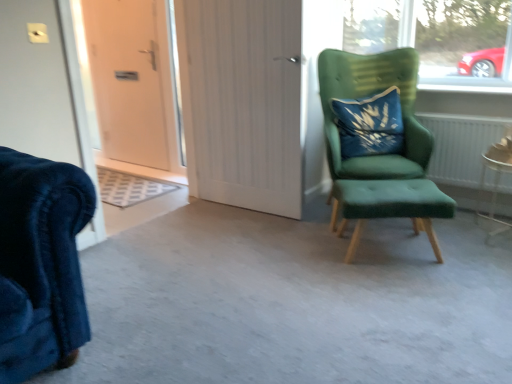
Question: Which direction should I rotate to face white wood door at center, acting as the 1th door starting from the front, — up or down?

Choices:
 (A) up
 (B) down

Answer: (A)

Question: Is green fabric stool at right inside green fabric chair at right?

Choices:
 (A) yes
 (B) no

Answer: (B)

Question: Is green fabric stool at right at the back of green fabric chair at right?

Choices:
 (A) no
 (B) yes

Answer: (A)

Question: Is green fabric chair at right not close to green fabric stool at right?

Choices:
 (A) yes
 (B) no

Answer: (B)

Question: Is green fabric chair at right at the right side of green fabric stool at right?

Choices:
 (A) yes
 (B) no

Answer: (A)

Question: Is green fabric chair at right outside of green fabric stool at right?

Choices:
 (A) yes
 (B) no

Answer: (A)

Question: Is green fabric chair at right thinner than green fabric stool at right?

Choices:
 (A) no
 (B) yes

Answer: (A)

Question: Is transparent glass door at upper left far from metallic silver side table at lower right?

Choices:
 (A) yes
 (B) no

Answer: (A)

Question: From a real-world perspective, is transparent glass door at upper left positioned under metallic silver side table at lower right based on gravity?

Choices:
 (A) no
 (B) yes

Answer: (A)

Question: From the image's perspective, is transparent glass door at upper left over metallic silver side table at lower right?

Choices:
 (A) yes
 (B) no

Answer: (A)

Question: Is metallic silver side table at lower right at the back of transparent glass door at upper left?

Choices:
 (A) yes
 (B) no

Answer: (B)

Question: Are transparent glass door at upper left and metallic silver side table at lower right making contact?

Choices:
 (A) yes
 (B) no

Answer: (B)

Question: Is transparent glass door at upper left outside of metallic silver side table at lower right?

Choices:
 (A) yes
 (B) no

Answer: (A)

Question: Is white wood door at center, the second door positioned from the left, smaller than blue velvet pillow at upper right?

Choices:
 (A) no
 (B) yes

Answer: (A)